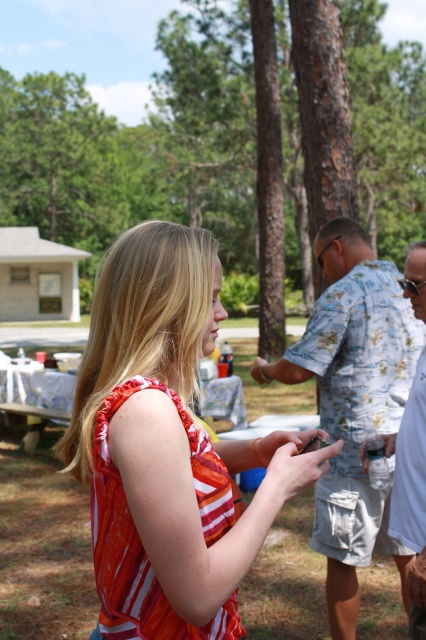
Question: Does orange striped tank top at center appear over white cotton shirt at right?

Choices:
 (A) yes
 (B) no

Answer: (A)

Question: Which is farther from the floral shirt at center?

Choices:
 (A) orange striped tank top at center
 (B) white cotton shirt at right

Answer: (A)

Question: In this image, where is floral shirt at center located relative to white cotton shirt at right?

Choices:
 (A) left
 (B) right

Answer: (A)

Question: Is floral shirt at center to the right of white cotton shirt at right from the viewer's perspective?

Choices:
 (A) no
 (B) yes

Answer: (A)

Question: Which object is the closest to the white cotton shirt at right?

Choices:
 (A) floral shirt at center
 (B) orange striped tank top at center

Answer: (A)

Question: Among these objects, which one is farthest from the camera?

Choices:
 (A) floral shirt at center
 (B) white cotton shirt at right

Answer: (A)